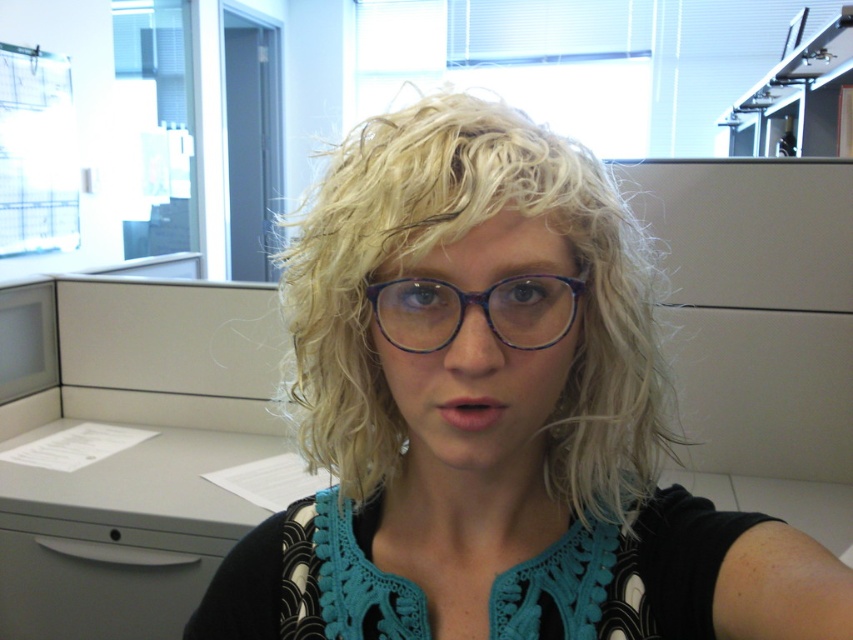
You are taking a photo of the person in the office scene and want to focus on two specific points marked as point 1 at coordinates (405, 388) and point 2 at coordinates (207, 564). Which point should you focus on first to ensure the person in the foreground is sharp?

Point 1 at coordinates (405, 388) should be focused on first because it is closer to the camera than point 2 at coordinates (207, 564), ensuring the foreground subject remains sharp.

You are an AI analyzing a portrait photo. The photo shows a person with specific features. Based on the coordinates provided, where exactly is the blonde hair at center located in the image?

The blonde hair at center is located at the 2D coordinates point (492,417).

You are a photographer setting up a shot of the person in the scene. You need to ensure that the blonde hair at center and the purple acetate glasses at center are both in focus. Given that your camera has a depth of field that can cover 5 inches, will both objects be in focus?

The blonde hair at center is 4.67 inches away from purple acetate glasses at center. Since the distance between them is less than the 5 inches depth of field, both objects will be in focus.